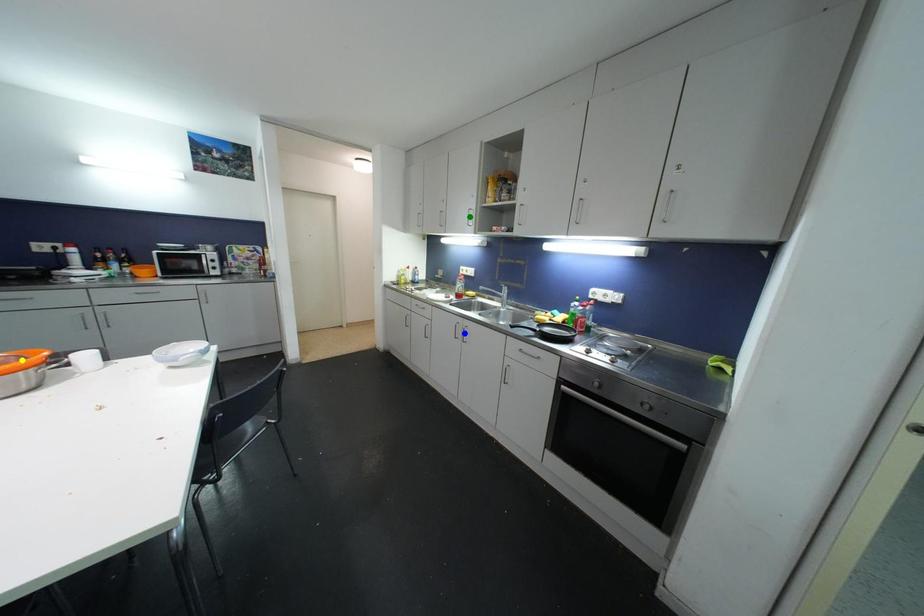
Order these from nearest to farthest:
yellow point, green point, blue point

yellow point → blue point → green point